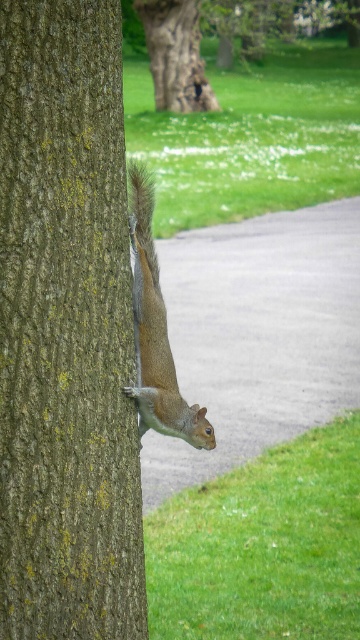
You are a bird flying above the park and see the smooth brown bark at center and the fuzzy brown tail at upper right. Which object is shorter in height?

The smooth brown bark at center is shorter in height compared to the fuzzy brown tail at upper right.

You are a small insect trying to climb up the tree trunk. You notice two sections of bark at the upper center of the tree. Which section of bark, the brown rough bark at upper center or the smooth brown bark at upper center, would provide better grip for climbing?

The brown rough bark at upper center provides better grip for climbing because its texture is rougher compared to the smooth brown bark at upper center.

You are a painter setting up an easel to sketch the tree in the park. You want to highlight the contrast between the brown rough bark at upper center and the smooth brown bark at upper center in your painting. Which part of the tree should you focus on to show the difference in texture?

The brown rough bark at upper center has a narrower width compared to the smooth brown bark at upper center, so focusing on the brown rough bark at upper center will emphasize its texture contrast due to its smaller size.